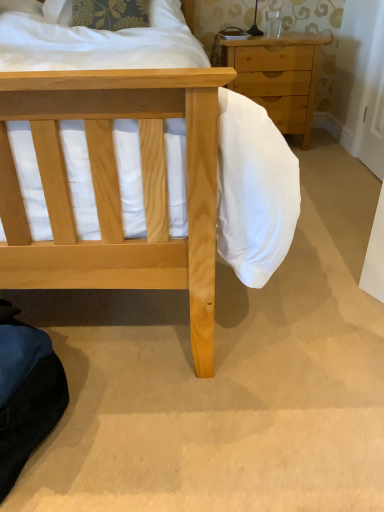
Question: Is light wood/texture chest of drawers at upper right spatially inside white fabric pillow at upper left, or outside of it?

Choices:
 (A) inside
 (B) outside

Answer: (B)

Question: From a real-world perspective, is light wood/texture chest of drawers at upper right physically located above or below white fabric pillow at upper left?

Choices:
 (A) above
 (B) below

Answer: (B)

Question: Is point (236, 41) closer or farther from the camera than point (79, 23)?

Choices:
 (A) farther
 (B) closer

Answer: (A)

Question: Is point pos(127,19) closer or farther from the camera than point pos(248,50)?

Choices:
 (A) closer
 (B) farther

Answer: (A)

Question: Is white fabric pillow at upper left bigger or smaller than light wood/texture chest of drawers at upper right?

Choices:
 (A) small
 (B) big

Answer: (A)

Question: Considering their positions, is white fabric pillow at upper left located in front of or behind light wood/texture chest of drawers at upper right?

Choices:
 (A) behind
 (B) front

Answer: (B)

Question: Is white fabric pillow at upper left taller or shorter than light wood/texture chest of drawers at upper right?

Choices:
 (A) tall
 (B) short

Answer: (B)